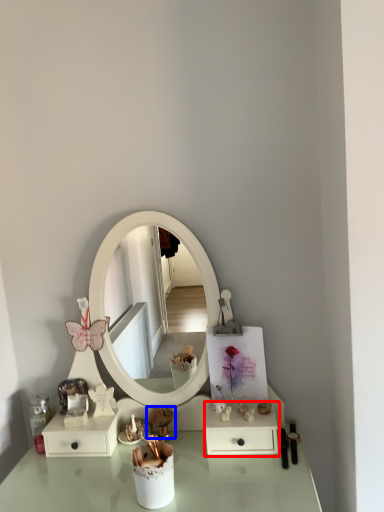
Question: Which object appears farthest to the camera in this image, dresser (highlighted by a red box) or toy (highlighted by a blue box)?

Choices:
 (A) dresser
 (B) toy

Answer: (B)